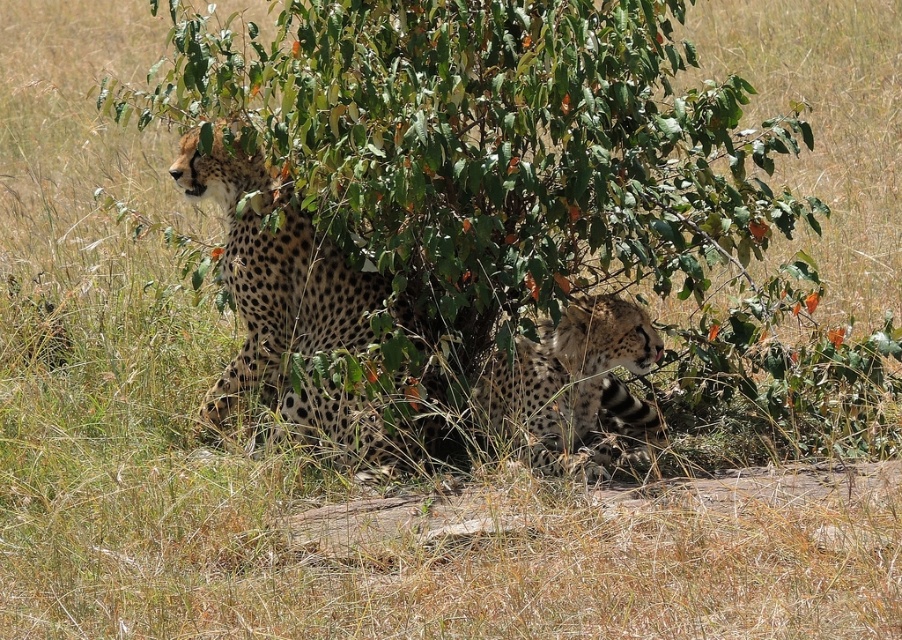
Question: Which of the following is the farthest from the observer?

Choices:
 (A) spotted fur cheetah at lower right
 (B) spotted fur cheetah at center

Answer: (A)

Question: From the image, what is the correct spatial relationship of spotted fur cheetah at center in relation to spotted fur cheetah at lower right?

Choices:
 (A) left
 (B) right

Answer: (A)

Question: Can you confirm if spotted fur cheetah at center is positioned above spotted fur cheetah at lower right?

Choices:
 (A) yes
 (B) no

Answer: (A)

Question: Is spotted fur cheetah at center closer to the viewer compared to spotted fur cheetah at lower right?

Choices:
 (A) yes
 (B) no

Answer: (A)

Question: Which point appears closest to the camera in this image?

Choices:
 (A) (587, 445)
 (B) (183, 186)

Answer: (A)